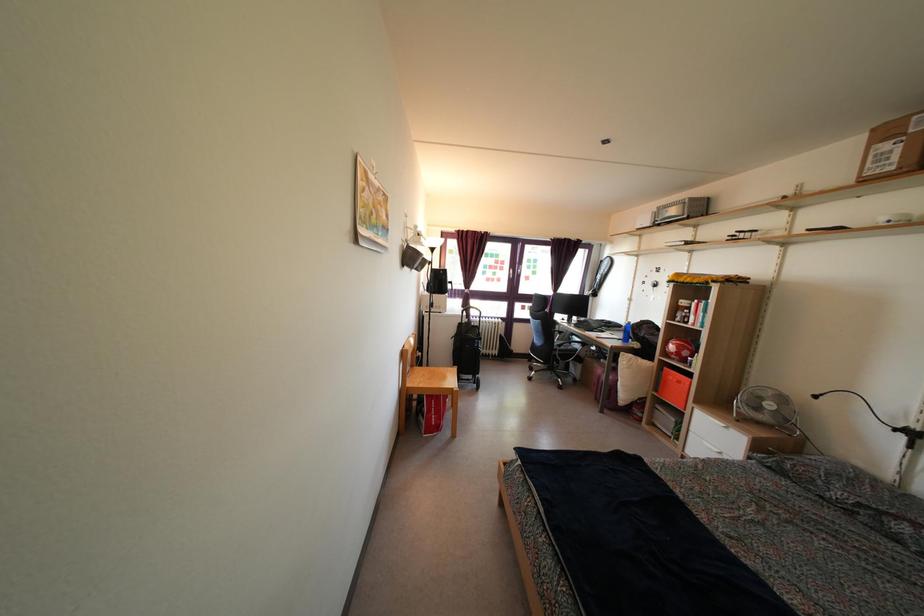
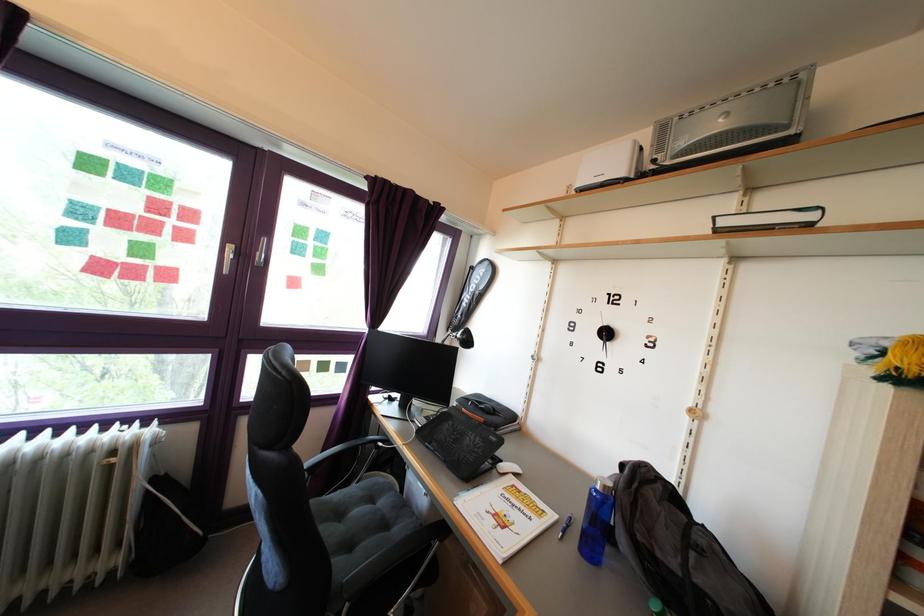
Question: I am providing you with two images of the same scene from different viewpoints. After the viewpoint changes to image2, which objects are now occluded?

Choices:
 (A) white book
 (B) white computer mouse
 (C) blue water bottle
 (D) none of these

Answer: (D)